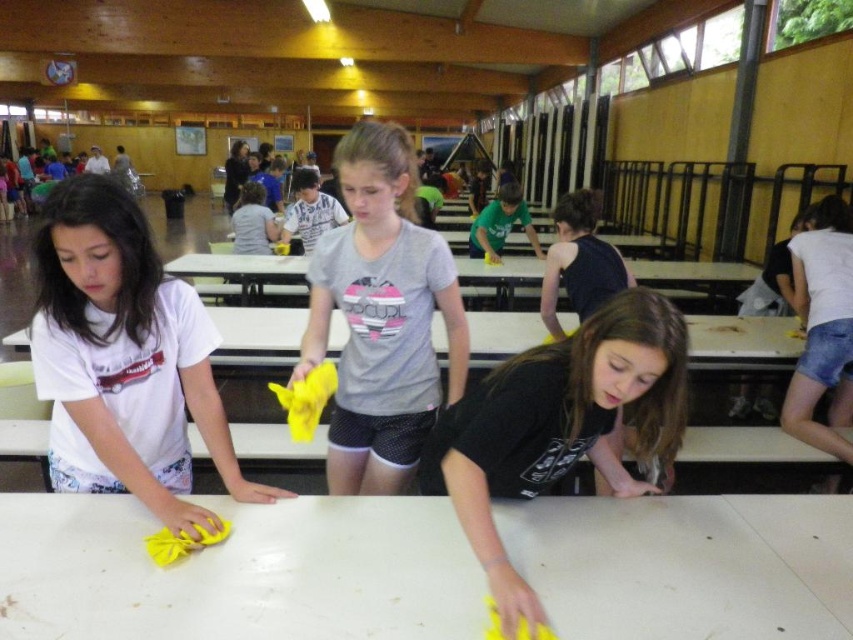
You are standing in the indoor facility and want to move from point A to point B. Point A is at coordinate point point (366, 401) and point B is at coordinate point point (543, 305). Which point is closer to you?

Point point (366, 401) is closer to the viewer than point point (543, 305).